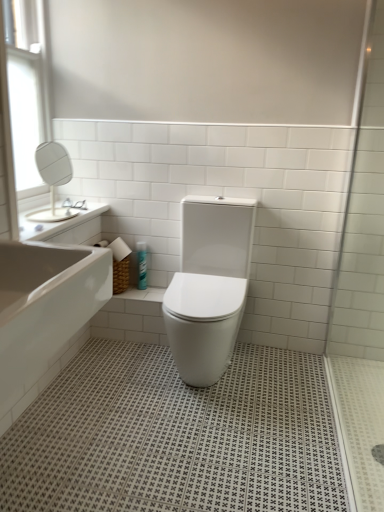
Question: From the image's perspective, relative to transparent glass shower door at right, is blue glossy spray can at center above or below?

Choices:
 (A) below
 (B) above

Answer: (A)

Question: In terms of width, does blue glossy spray can at center look wider or thinner when compared to transparent glass shower door at right?

Choices:
 (A) wide
 (B) thin

Answer: (B)

Question: Which is nearer to the white glass window at upper left?

Choices:
 (A) white glossy bathtub at lower left
 (B) woven brown basket at lower left
 (C) white glossy toilet at center
 (D) white glossy sink at upper left
 (E) blue glossy spray can at center

Answer: (D)

Question: Estimate the real-world distances between objects in this image. Which object is farther from the woven brown basket at lower left?

Choices:
 (A) white glass window at upper left
 (B) blue glossy spray can at center
 (C) white glossy toilet at center
 (D) white glossy sink at upper left
 (E) white glossy bathtub at lower left

Answer: (E)